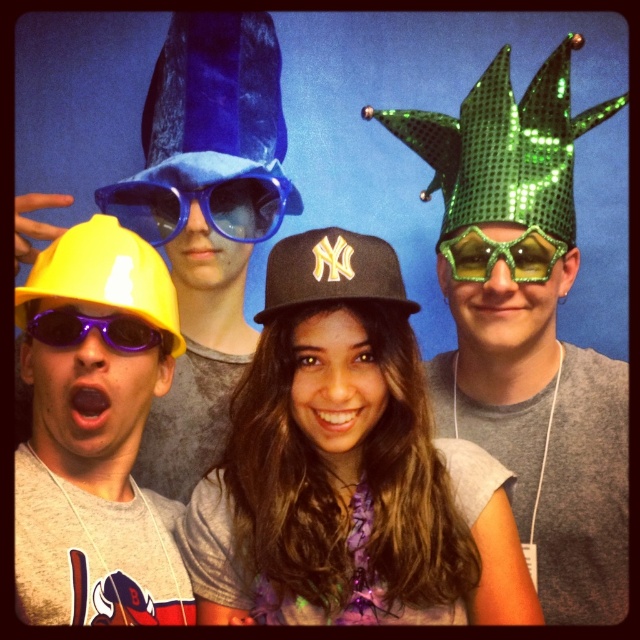
Question: Does green sequined crown at center have a greater width compared to blue velvet baseball hat at upper left?

Choices:
 (A) no
 (B) yes

Answer: (B)

Question: Based on their relative distances, which object is farther from the blue plastic sunglasses at upper center?

Choices:
 (A) purple plastic sunglasses at lower left
 (B) black matte baseball cap at center
 (C) green sequined goggles at upper right

Answer: (B)

Question: Which point is closer to the camera taking this photo?

Choices:
 (A) (268, 106)
 (B) (172, 497)
 (C) (243, 461)

Answer: (C)

Question: Does matte yellow hard hat at left have a lesser width compared to green sequined baseball cap at upper right?

Choices:
 (A) yes
 (B) no

Answer: (A)

Question: Among these points, which one is farthest from the camera?

Choices:
 (A) (237, 28)
 (B) (273, 259)

Answer: (A)

Question: Can you confirm if matte yellow hard hat at left is bigger than green sequined goggles at upper right?

Choices:
 (A) yes
 (B) no

Answer: (A)